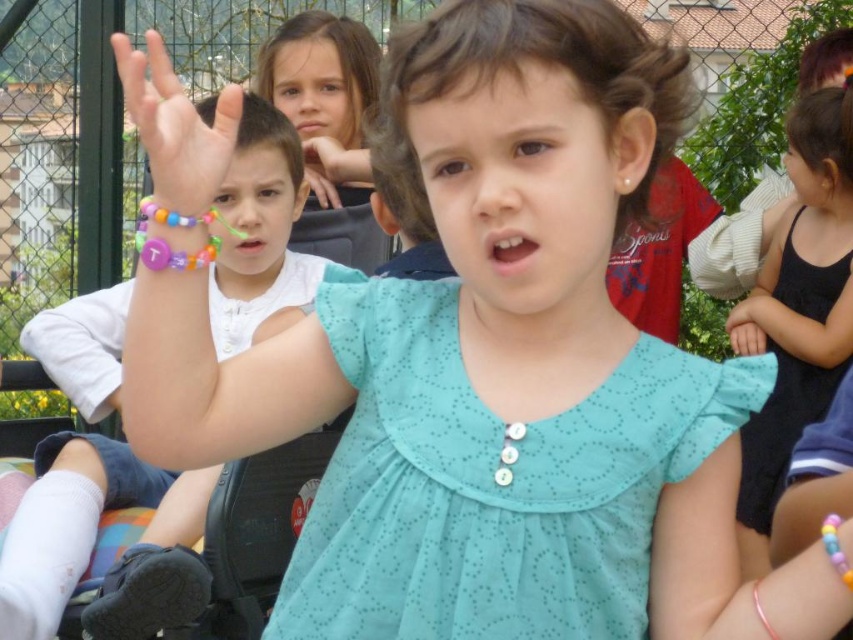
Is the position of matte plastic face at center more distant than that of smooth skin face at upper center?

No.

Is point (242, 272) positioned in front of point (322, 42)?

Yes, it is.

The width and height of the screenshot is (853, 640). What do you see at coordinates (256, 214) in the screenshot?
I see `matte plastic face at center` at bounding box center [256, 214].

What are the coordinates of `matte plastic face at center` in the screenshot? It's located at (256, 214).

In the scene shown: Does white fabric shirt at left come behind smooth skin face at center?

No, white fabric shirt at left is closer to the viewer.

Can you confirm if white fabric shirt at left is taller than smooth skin face at center?

Yes, white fabric shirt at left is taller than smooth skin face at center.

Find the location of a particular element. white fabric shirt at left is located at coordinates (158, 568).

In order to click on white fabric shirt at left in this screenshot , I will do `click(158, 568)`.

Is point (154, 529) less distant than point (144, 99)?

No, it is behind (144, 99).

Is point (115, 563) farther from camera compared to point (183, 125)?

Yes, it is.

At what (x,y) coordinates should I click in order to perform the action: click on white fabric shirt at left. Please return your answer as a coordinate pair (x, y). The height and width of the screenshot is (640, 853). Looking at the image, I should click on (158, 568).